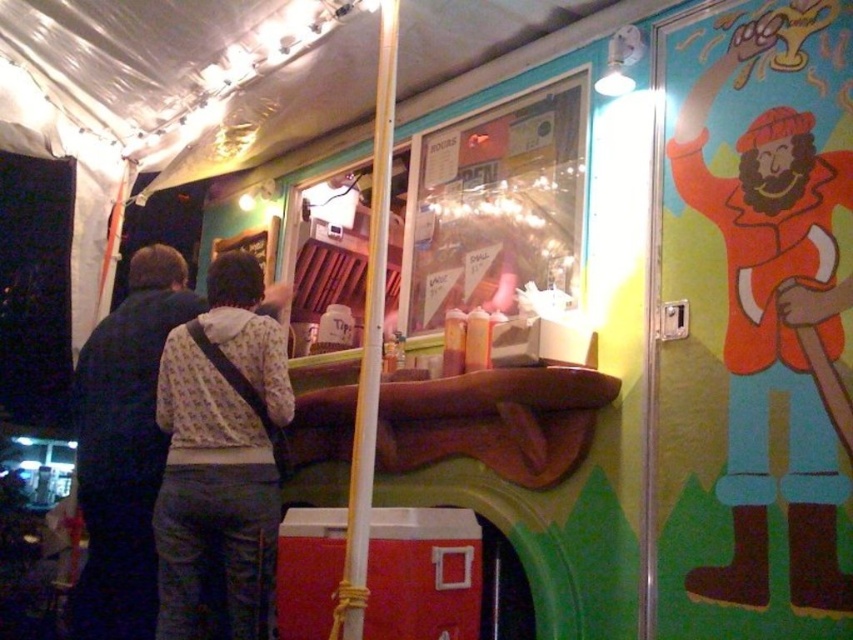
You are a customer at this eatery and want to know if your friend wearing the dark blue jacket at left can reach the menu placed on top of the wooden pole at center. Can they?

The dark blue jacket at left is not as tall as the wooden pole at center, so the friend wearing the dark blue jacket at left may not be able to reach the menu placed on top of the wooden pole at center.

You are a food truck worker who needs to hand a hot meal to the customer. The customer is wearing a dark blue jacket at left. You are standing at the counter where the white printed shirt at center is located. Can you safely hand the meal without needing to step back?

The distance between the white printed shirt at center and the dark blue jacket at left is 27.89 centimeters. Since this distance is sufficient for handing over the meal without needing extra space, you can safely proceed.

You are a customer at the food truck and want to order a meal. You see the white printed shirt at center and the dark blue jacket at left. Which person should you approach to place your order?

You should approach the white printed shirt at center because they are closer to you than the dark blue jacket at left.